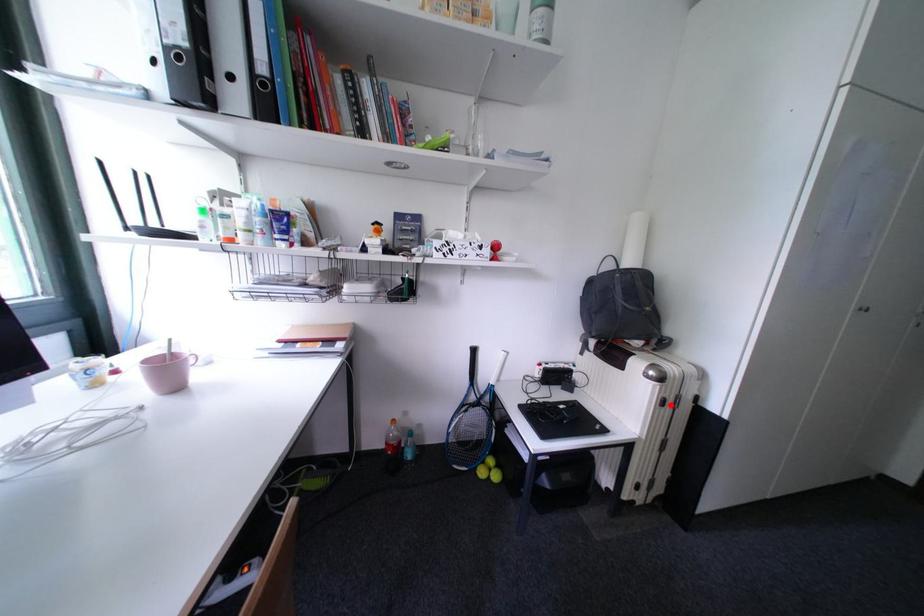
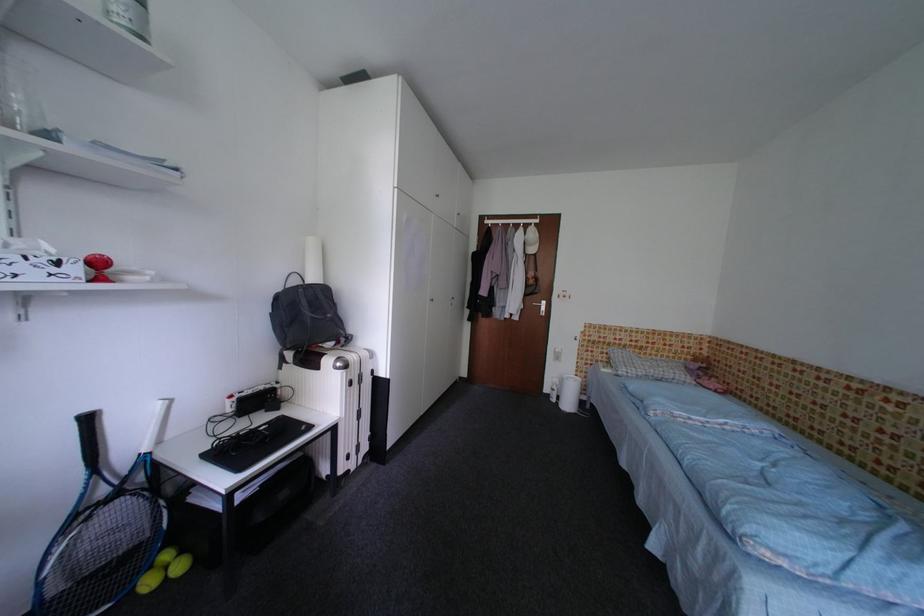
Question: I am providing you with two images of the same scene from different viewpoints. Image1 has a red point marked. In image2, the corresponding 3D location appears at what relative position? Reply with the corresponding letter.

Choices:
 (A) Closer
 (B) Farther

Answer: (A)